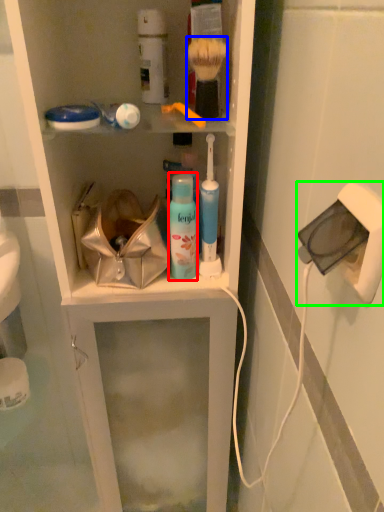
Question: Based on their relative distances, which object is farther from mouthwash (highlighted by a red box)? Choose from brush (highlighted by a blue box) and electric outlet (highlighted by a green box).

Choices:
 (A) brush
 (B) electric outlet

Answer: (B)